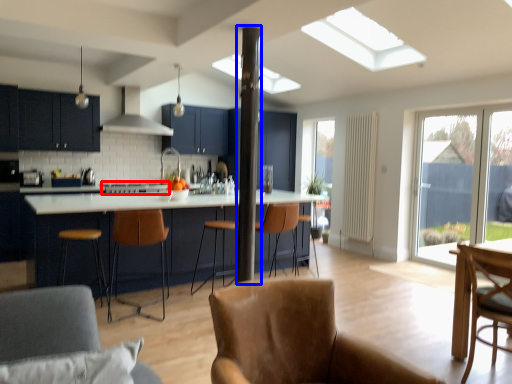
Question: Which of the following is the closest to the observer, stove (highlighted by a red box) or beam (highlighted by a blue box)?

Choices:
 (A) stove
 (B) beam

Answer: (B)